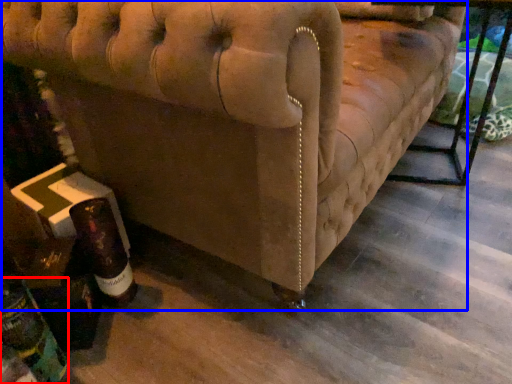
Question: Which object appears farthest to the camera in this image, bottle (highlighted by a red box) or furniture (highlighted by a blue box)?

Choices:
 (A) bottle
 (B) furniture

Answer: (A)